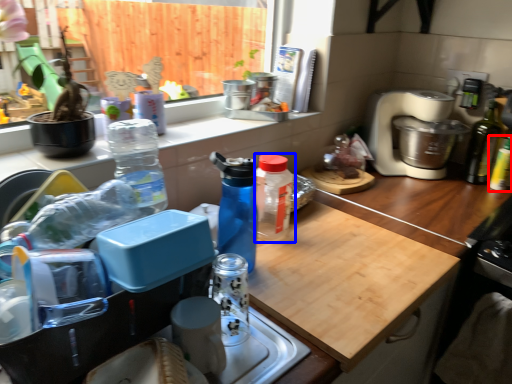
Question: Among these objects, which one is farthest to the camera, bottle (highlighted by a red box) or bottle (highlighted by a blue box)?

Choices:
 (A) bottle
 (B) bottle

Answer: (A)